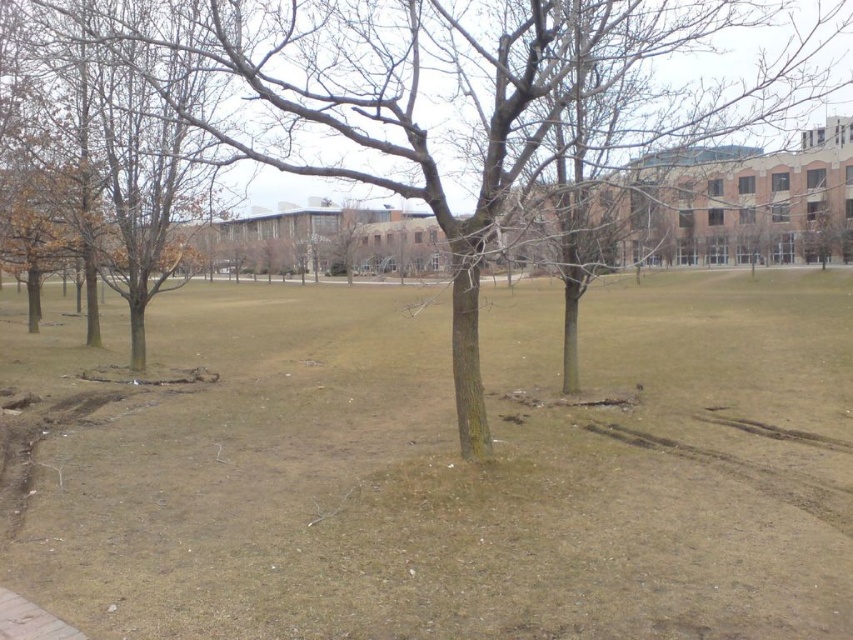
Question: Does brown dry grass at center have a larger size compared to brown bark tree at center?

Choices:
 (A) no
 (B) yes

Answer: (A)

Question: Which of the following is the farthest from the observer?

Choices:
 (A) brown dry grass at center
 (B) brown bark tree at center

Answer: (B)

Question: Does brown dry grass at center appear on the right side of brown bark tree at center?

Choices:
 (A) no
 (B) yes

Answer: (B)

Question: Can you confirm if brown dry grass at center is bigger than brown bark tree at center?

Choices:
 (A) yes
 (B) no

Answer: (B)